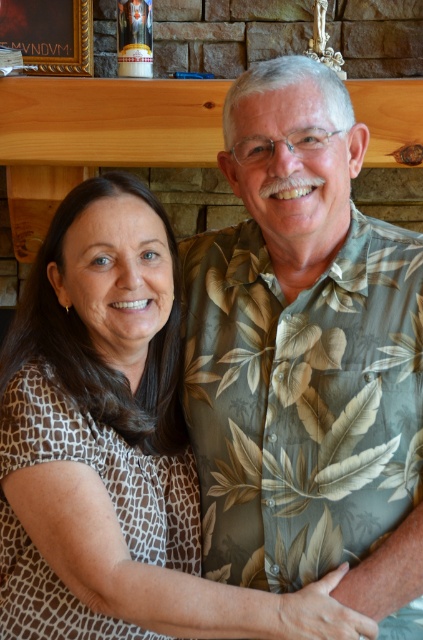
You are arranging a photo shoot and need to ensure that the brown textured blouse at center and the gold wooden picture frame at upper left are visible in the shot. Based on their positions, which object should be closer to the bottom of the frame?

The brown textured blouse at center is located below the gold wooden picture frame at upper left, so it should be closer to the bottom of the frame.